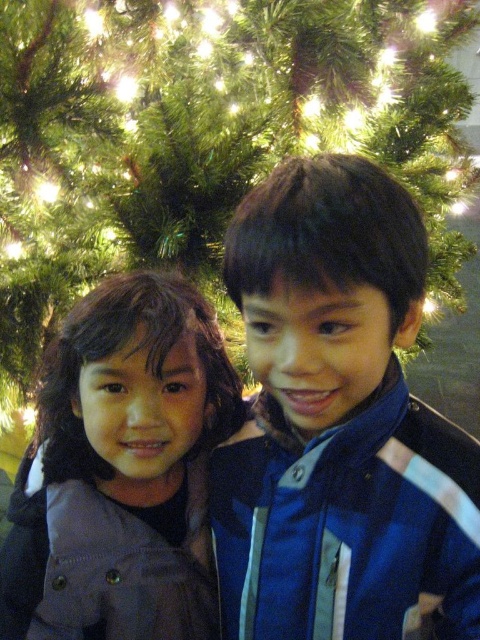
You are a photographer trying to capture a group photo of the children. The blue fabric jacket at center and the matte gray jacket at center are currently too close to each other. What is the minimum distance you need to move them apart so that there is at least 8 inches between their jackets?

The blue fabric jacket at center is currently 6.59 inches away from the matte gray jacket at center. To achieve at least 8 inches between them, they need to be moved apart by an additional 1.41 inches.

You are a photographer taking a picture of the green textured fir tree at upper center and the blue fabric jacket at center. Which object should you focus on first to ensure both are in focus?

You should focus on the green textured fir tree at upper center first because the blue fabric jacket at center is behind it, so adjusting focus starting from the tree ensures both are sharp.

You are a photographer trying to capture a clear photo of both the blue fabric jacket at center and the matte gray jacket at center. Which jacket should you focus on first to ensure both are in focus?

You should focus on the blue fabric jacket at center first since it is closer to the viewer than the matte gray jacket at center. By focusing on the closer jacket, the farther one will also be in focus due to the depth of field.